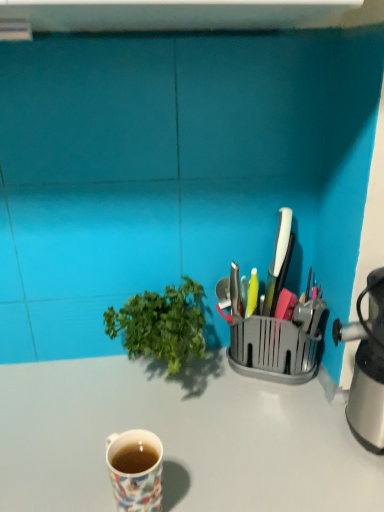
What are the coordinates of `free space that is in between green leafy plant at center and metallic silver knife block at right` in the screenshot? It's located at (240, 386).